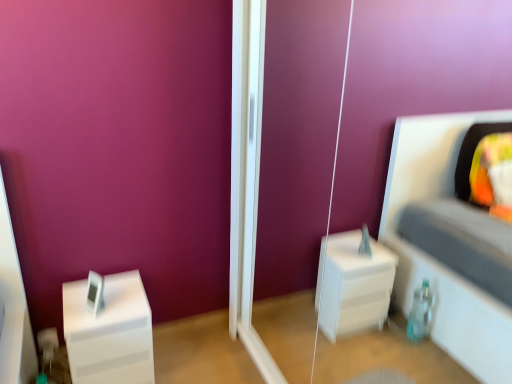
Question: From the image's perspective, is transparent glass door at center above white glossy nightstand at left?

Choices:
 (A) yes
 (B) no

Answer: (A)

Question: Is transparent glass door at center thinner than white glossy nightstand at left?

Choices:
 (A) yes
 (B) no

Answer: (A)

Question: Is transparent glass door at center further to camera compared to white glossy nightstand at left?

Choices:
 (A) no
 (B) yes

Answer: (A)

Question: From a real-world perspective, is transparent glass door at center located beneath white glossy nightstand at left?

Choices:
 (A) yes
 (B) no

Answer: (B)

Question: From a real-world perspective, is transparent glass door at center over white glossy nightstand at left?

Choices:
 (A) no
 (B) yes

Answer: (B)

Question: Is transparent glass door at center positioned far away from white glossy nightstand at left?

Choices:
 (A) no
 (B) yes

Answer: (A)

Question: Does white glossy nightstand at left turn towards transparent glass door at center?

Choices:
 (A) yes
 (B) no

Answer: (B)

Question: From a real-world perspective, does white glossy nightstand at left sit lower than transparent glass door at center?

Choices:
 (A) no
 (B) yes

Answer: (B)

Question: Does white glossy nightstand at left have a smaller size compared to transparent glass door at center?

Choices:
 (A) no
 (B) yes

Answer: (B)

Question: Is white glossy nightstand at left outside transparent glass door at center?

Choices:
 (A) yes
 (B) no

Answer: (A)

Question: Is white glossy nightstand at left to the right of transparent glass door at center from the viewer's perspective?

Choices:
 (A) no
 (B) yes

Answer: (A)

Question: Are white glossy nightstand at left and transparent glass door at center far apart?

Choices:
 (A) no
 (B) yes

Answer: (A)

Question: From a real-world perspective, relative to white glossy nightstand at left, is transparent glass door at center vertically above or below?

Choices:
 (A) above
 (B) below

Answer: (A)